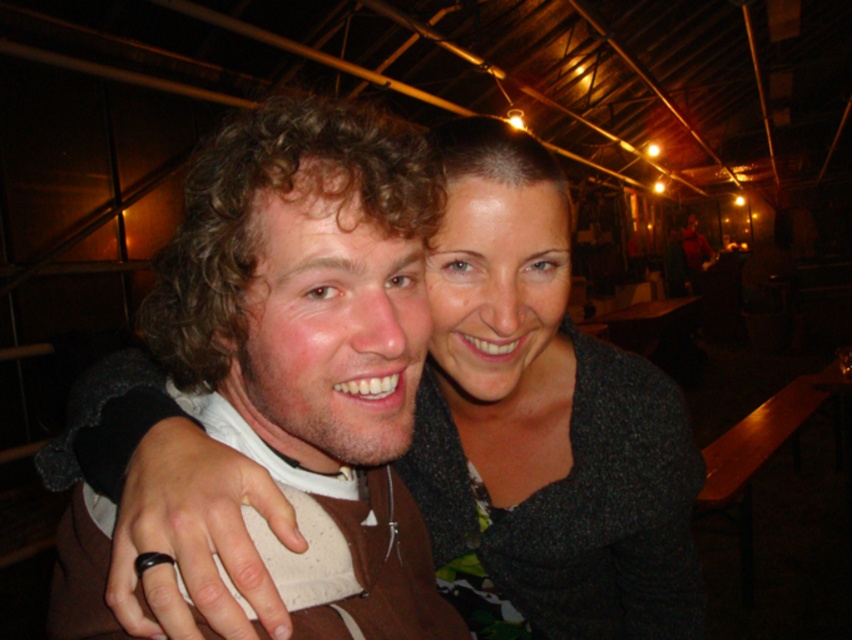
You are a fashion designer observing two outfits in the image. The brown fuzzy jacket at center and the matte gray sweater at center are both worn by people. Which of these two items is shorter in length?

The brown fuzzy jacket at center is shorter than the matte gray sweater at center.

You are a photographer at this event and need to ensure both the brown fuzzy jacket at center and the matte gray sweater at center are visible in the photo. Given their current positions, is there any part of either garment that might be obscured by the other?

The brown fuzzy jacket at center is positioned over the matte gray sweater at center, so part of the matte gray sweater at center may be obscured by the brown fuzzy jacket at center. Adjust the angle or position to ensure full visibility of both garments.